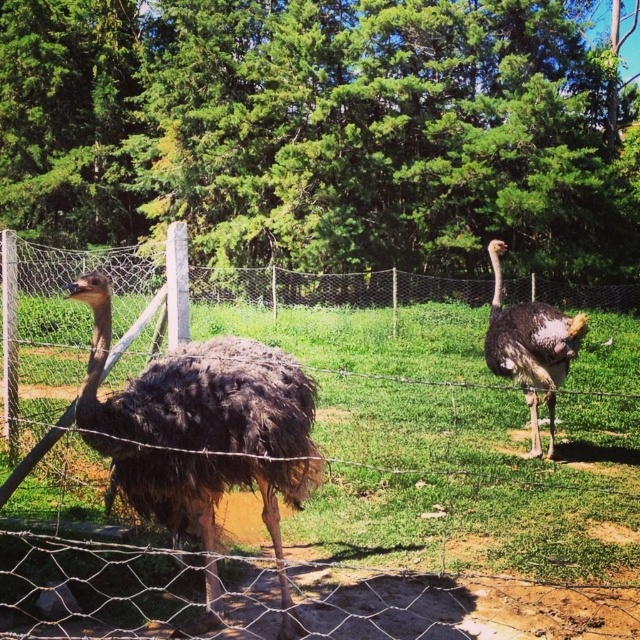
Consider the image. You are a zookeeper observing the ostriches in their enclosure. You need to approach the brown feathered ostrich at left and the dark brown feathered ostrich at right to feed them. Which ostrich should you approach first if you want to reach the closest one first?

The brown feathered ostrich at left is closer to you than the dark brown feathered ostrich at right, so you should approach the brown feathered ostrich at left first.